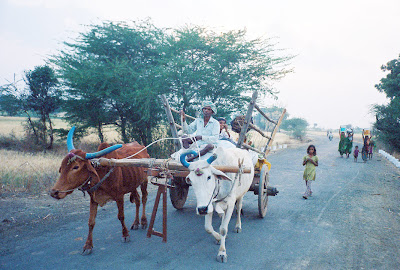
Locate an element on the screen. water jug is located at coordinates (366, 132).